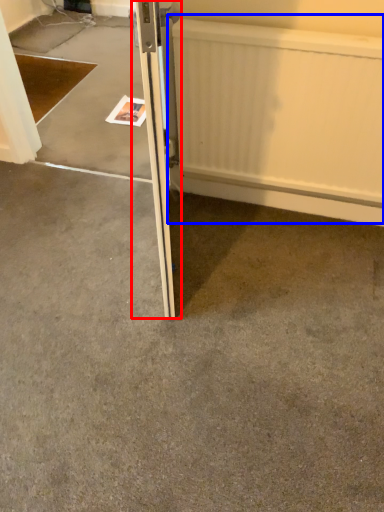
Question: Among these objects, which one is nearest to the camera, door (highlighted by a red box) or radiator (highlighted by a blue box)?

Choices:
 (A) door
 (B) radiator

Answer: (A)